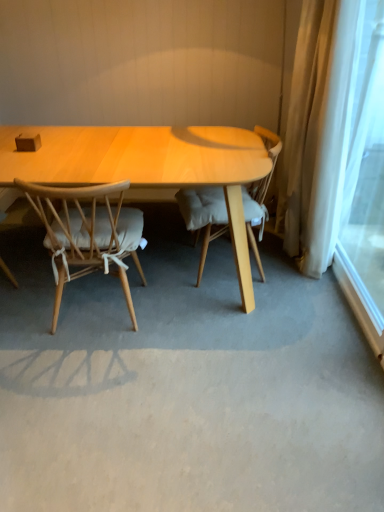
What do you see at coordinates (203, 215) in the screenshot? I see `light brown wood chair at center, marked as the 1th chair in a right-to-left arrangement` at bounding box center [203, 215].

What do you see at coordinates (366, 175) in the screenshot? The image size is (384, 512). I see `white sheer curtain at right` at bounding box center [366, 175].

Locate an element on the screen. The image size is (384, 512). light wood chair with cushion at left, which is counted as the 1th chair, starting from the left is located at coordinates (87, 233).

From a real-world perspective, is white sheer curtain at right physically located above or below light wood chair with cushion at left, arranged as the 2th chair when viewed from the right?

Clearly, from a real-world perspective, white sheer curtain at right is above light wood chair with cushion at left, arranged as the 2th chair when viewed from the right.

How many degrees apart are the facing directions of white sheer curtain at right and light wood chair with cushion at left, arranged as the 2th chair when viewed from the right?

They differ by 89.3 degrees in their facing directions.

Are white sheer curtain at right and light wood chair with cushion at left, arranged as the 2th chair when viewed from the right, far apart?

Absolutely, white sheer curtain at right is distant from light wood chair with cushion at left, arranged as the 2th chair when viewed from the right.

Do you think white sheer curtain at right is within light wood chair with cushion at left, arranged as the 2th chair when viewed from the right, or outside of it?

white sheer curtain at right is spatially situated outside light wood chair with cushion at left, arranged as the 2th chair when viewed from the right.

Which of these two, light wood chair with cushion at left, which is counted as the 1th chair, starting from the left, or white sheer curtain at right, is wider?

light wood chair with cushion at left, which is counted as the 1th chair, starting from the left.

Is light wood chair with cushion at left, which is counted as the 1th chair, starting from the left, at the left side of white sheer curtain at right?

Indeed, light wood chair with cushion at left, which is counted as the 1th chair, starting from the left, is positioned on the left side of white sheer curtain at right.

Locate an element on the screen. Image resolution: width=384 pixels, height=512 pixels. the 2nd chair below when counting from the white sheer curtain at right (from the image's perspective) is located at coordinates (87, 233).

Can we say white sheer curtain at right lies outside light brown wood chair at center, marked as the 1th chair in a right-to-left arrangement?

Yes, white sheer curtain at right is outside of light brown wood chair at center, marked as the 1th chair in a right-to-left arrangement.

In order to click on window screen located on the right of light brown wood chair at center, marked as the 1th chair in a right-to-left arrangement in this screenshot , I will do `click(366, 175)`.

Could you tell me if white sheer curtain at right is facing light brown wood chair at center, the 2th chair positioned from the left?

Yes, white sheer curtain at right is turned towards light brown wood chair at center, the 2th chair positioned from the left.

From the image's perspective, who appears lower, white sheer curtain at right or light brown wood chair at center, the 2th chair positioned from the left?

light brown wood chair at center, the 2th chair positioned from the left, from the image's perspective.

Can we say light wood chair with cushion at left, arranged as the 2th chair when viewed from the right, lies outside light brown wood chair at center, marked as the 1th chair in a right-to-left arrangement?

light wood chair with cushion at left, arranged as the 2th chair when viewed from the right, is positioned outside light brown wood chair at center, marked as the 1th chair in a right-to-left arrangement.

Which object is wider, light wood chair with cushion at left, arranged as the 2th chair when viewed from the right, or light brown wood chair at center, the 2th chair positioned from the left?

Wider between the two is light wood chair with cushion at left, arranged as the 2th chair when viewed from the right.

Between light wood chair with cushion at left, which is counted as the 1th chair, starting from the left, and light brown wood chair at center, the 2th chair positioned from the left, which one has less height?

Standing shorter between the two is light wood chair with cushion at left, which is counted as the 1th chair, starting from the left.

Does light wood chair with cushion at left, which is counted as the 1th chair, starting from the left, appear on the left side of light brown wood chair at center, the 2th chair positioned from the left?

Indeed, light wood chair with cushion at left, which is counted as the 1th chair, starting from the left, is positioned on the left side of light brown wood chair at center, the 2th chair positioned from the left.

From a real-world perspective, relative to light wood chair with cushion at left, arranged as the 2th chair when viewed from the right, is light brown wood chair at center, the 2th chair positioned from the left, vertically above or below?

In terms of real-world spatial position, light brown wood chair at center, the 2th chair positioned from the left, is above light wood chair with cushion at left, arranged as the 2th chair when viewed from the right.

Visually, is light brown wood chair at center, the 2th chair positioned from the left, positioned to the left or to the right of light wood chair with cushion at left, arranged as the 2th chair when viewed from the right?

From the image, it's evident that light brown wood chair at center, the 2th chair positioned from the left, is to the right of light wood chair with cushion at left, arranged as the 2th chair when viewed from the right.

Can you confirm if light brown wood chair at center, the 2th chair positioned from the left, is wider than light wood chair with cushion at left, which is counted as the 1th chair, starting from the left?

Incorrect, the width of light brown wood chair at center, the 2th chair positioned from the left, does not surpass that of light wood chair with cushion at left, which is counted as the 1th chair, starting from the left.

Is light brown wood chair at center, the 2th chair positioned from the left, in contact with white sheer curtain at right?

No, light brown wood chair at center, the 2th chair positioned from the left, is not making contact with white sheer curtain at right.

Could white sheer curtain at right be considered to be inside light brown wood chair at center, the 2th chair positioned from the left?

No, white sheer curtain at right is located outside of light brown wood chair at center, the 2th chair positioned from the left.

Considering the positions of objects light brown wood chair at center, the 2th chair positioned from the left, and white sheer curtain at right in the image provided, who is behind, light brown wood chair at center, the 2th chair positioned from the left, or white sheer curtain at right?

light brown wood chair at center, the 2th chair positioned from the left, is further away from the camera.

Is point (222, 202) closer to camera compared to point (372, 73)?

Yes, point (222, 202) is closer to viewer.

There is a white sheer curtain at right. Where is `the 2nd chair below it (from the image's perspective)`? the 2nd chair below it (from the image's perspective) is located at coordinates (87, 233).

Find the location of a particular element. window screen in front of the light wood chair with cushion at left, which is counted as the 1th chair, starting from the left is located at coordinates (366, 175).

From the image, which object appears to be nearer to light brown wood chair at center, the 2th chair positioned from the left, white sheer curtain at right or light wood chair with cushion at left, which is counted as the 1th chair, starting from the left?

light wood chair with cushion at left, which is counted as the 1th chair, starting from the left, is closer to light brown wood chair at center, the 2th chair positioned from the left.

Which object lies nearer to the anchor point light brown wood chair at center, the 2th chair positioned from the left, light wood chair with cushion at left, which is counted as the 1th chair, starting from the left, or white sheer curtain at right?

light wood chair with cushion at left, which is counted as the 1th chair, starting from the left, lies closer to light brown wood chair at center, the 2th chair positioned from the left, than the other object.

Looking at the image, which one is located closer to white sheer curtain at right, light wood chair with cushion at left, arranged as the 2th chair when viewed from the right, or light brown wood chair at center, marked as the 1th chair in a right-to-left arrangement?

light brown wood chair at center, marked as the 1th chair in a right-to-left arrangement.

Looking at the image, which one is located closer to white sheer curtain at right, light brown wood chair at center, the 2th chair positioned from the left, or light wood chair with cushion at left, which is counted as the 1th chair, starting from the left?

light brown wood chair at center, the 2th chair positioned from the left, is positioned closer to the anchor white sheer curtain at right.

Which object lies further to the anchor point light wood chair with cushion at left, which is counted as the 1th chair, starting from the left, white sheer curtain at right or light brown wood chair at center, marked as the 1th chair in a right-to-left arrangement?

white sheer curtain at right is positioned further to the anchor light wood chair with cushion at left, which is counted as the 1th chair, starting from the left.

Estimate the real-world distances between objects in this image. Which object is further from light wood chair with cushion at left, arranged as the 2th chair when viewed from the right, light brown wood chair at center, marked as the 1th chair in a right-to-left arrangement, or white sheer curtain at right?

Among the two, white sheer curtain at right is located further to light wood chair with cushion at left, arranged as the 2th chair when viewed from the right.

Find the location of a particular element. Image resolution: width=384 pixels, height=512 pixels. chair between light wood chair with cushion at left, which is counted as the 1th chair, starting from the left, and white sheer curtain at right from left to right is located at coordinates (203, 215).